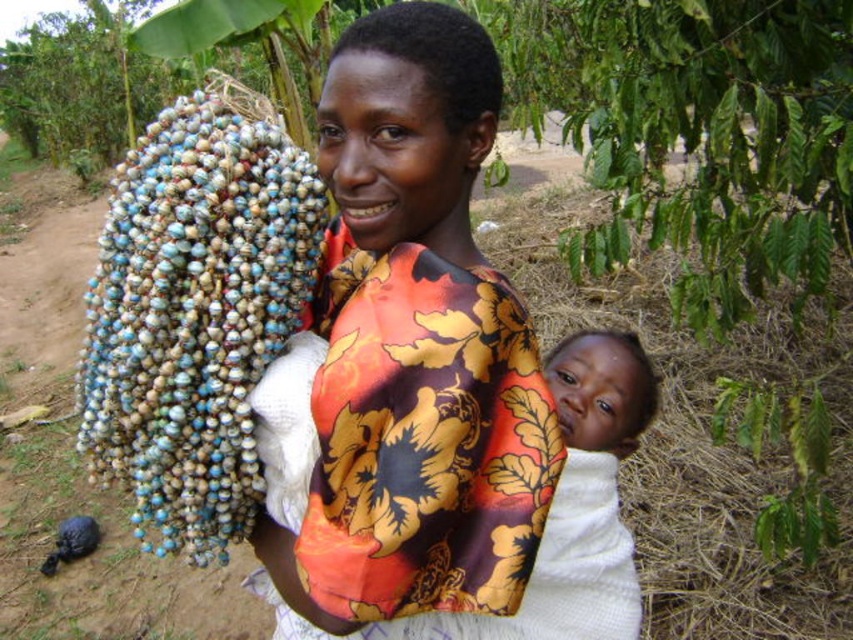
You are a fashion designer observing the woman in the image. You need to determine the placement of her accessories. Which accessory is positioned higher on her body between the beaded necklace at left and the white knitted cloth at center?

The beaded necklace at left is located above the white knitted cloth at center, so it is positioned higher on her body.